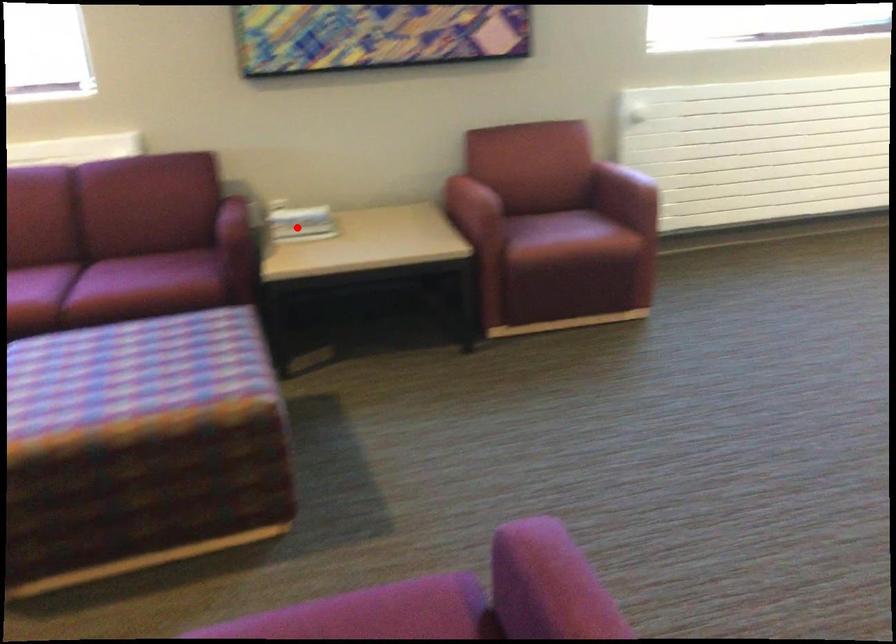
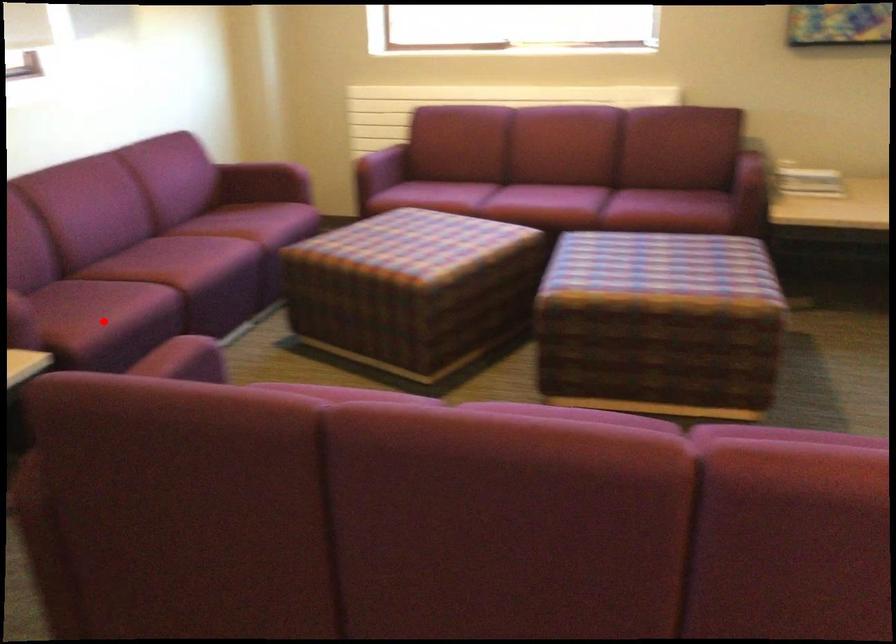
I am providing you with two images of the same scene from different viewpoints. A red point is marked on the first image and another point is marked on the second image. Are the points marked in image1 and image2 representing the same 3D position?

No